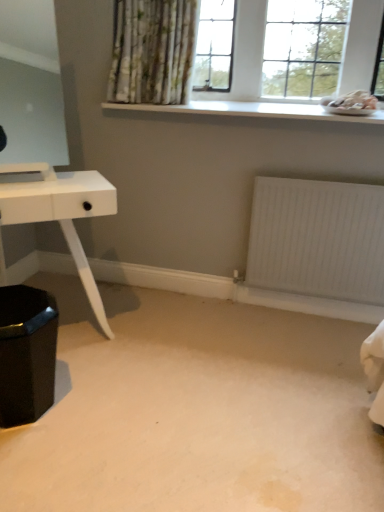
Question: Considering the positions of point (370, 120) and point (354, 246), is point (370, 120) closer or farther from the camera than point (354, 246)?

Choices:
 (A) farther
 (B) closer

Answer: (B)

Question: In the image, is white smooth window sill at upper center positioned in front of or behind white textured radiator at lower right?

Choices:
 (A) front
 (B) behind

Answer: (A)

Question: Which is farther from the shiny black hexagonal stool at lower left?

Choices:
 (A) white textured radiator at lower right
 (B) white glossy table at left
 (C) white wooden window at upper center
 (D) carpet at center
 (E) white smooth window sill at upper center

Answer: (C)

Question: Which is farther from the white smooth window sill at upper center?

Choices:
 (A) shiny black hexagonal stool at lower left
 (B) carpet at center
 (C) white glossy table at left
 (D) white textured radiator at lower right
 (E) white wooden window at upper center

Answer: (B)